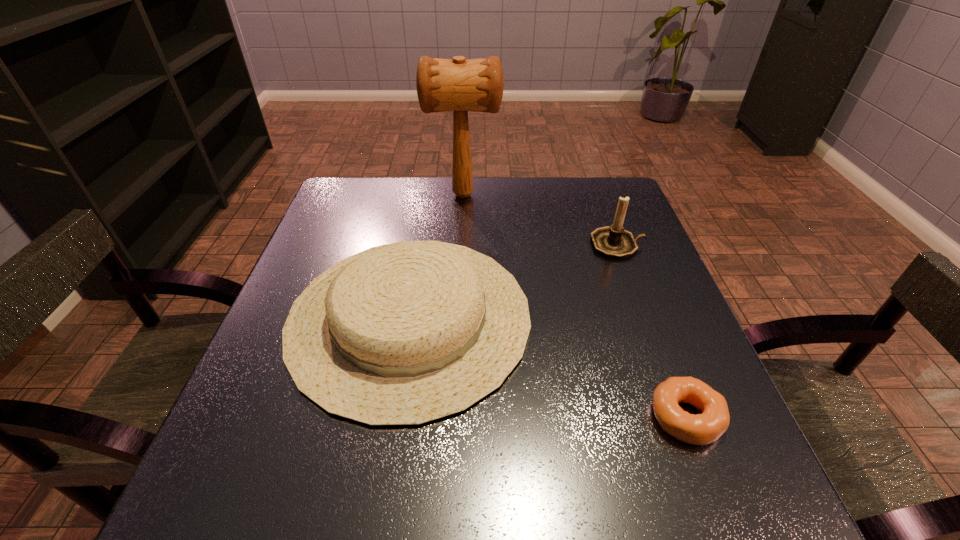
I want to click on object that is at the left edge, so click(403, 334).

Image resolution: width=960 pixels, height=540 pixels. In order to click on candle holder at the right edge in this screenshot , I will do `click(613, 241)`.

Locate an element on the screen. doughnut that is at the right edge is located at coordinates (700, 429).

Locate an element on the screen. This screenshot has height=540, width=960. vacant space at the far edge is located at coordinates (554, 211).

Locate an element on the screen. This screenshot has width=960, height=540. free spot at the left edge of the desktop is located at coordinates (274, 414).

Identify the location of vacant space at the right edge of the desktop. The width and height of the screenshot is (960, 540). (589, 267).

I want to click on vacant space at the far left corner, so click(376, 224).

The width and height of the screenshot is (960, 540). In the image, there is a desktop. Identify the location of vacant region at the near left corner. (184, 527).

In the image, there is a desktop. What are the coordinates of `vacant space at the far right corner` in the screenshot? It's located at (614, 199).

Where is `vacant space that's between the farthest object and the shortest object`? vacant space that's between the farthest object and the shortest object is located at coordinates (575, 306).